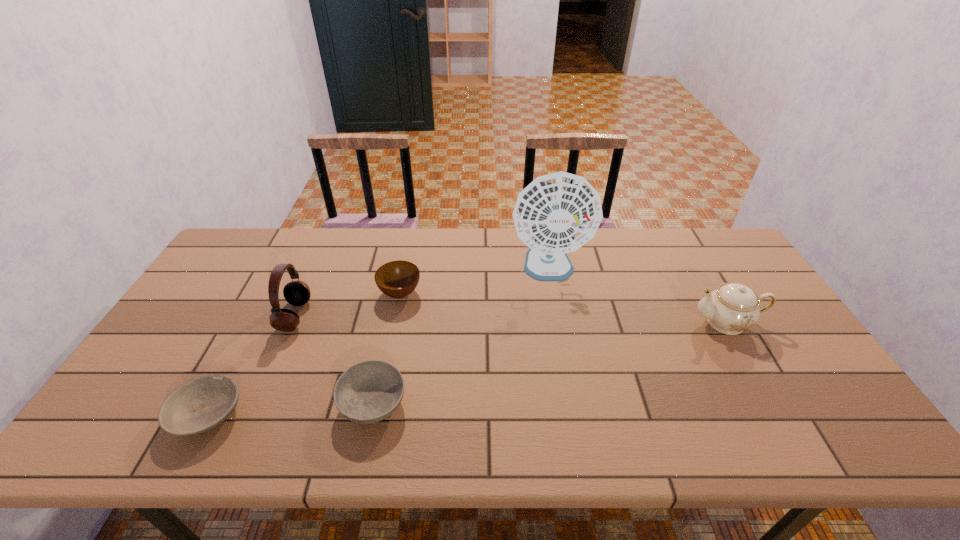
You are a GUI agent. You are given a task and a screenshot of the screen. Output one action in this format:
    pyautogui.click(x=<x>, y=<y>)
    Task: Click on the free spot located at the spout of the chinaware
    The width and height of the screenshot is (960, 540).
    Given the screenshot: What is the action you would take?
    pyautogui.click(x=670, y=322)

This screenshot has height=540, width=960. Find the location of `free spot located 0.150m at the spout of the chinaware`. free spot located 0.150m at the spout of the chinaware is located at coordinates (638, 322).

What are the coordinates of `blank area located at the spout of the chinaware` in the screenshot? It's located at (593, 322).

The image size is (960, 540). What are the coordinates of `free location located 0.050m on the left of the farthest bowl` in the screenshot? It's located at (362, 293).

I want to click on free space located 0.240m on the right of the shortest bowl, so click(x=344, y=415).

You are a GUI agent. You are given a task and a screenshot of the screen. Output one action in this format:
    pyautogui.click(x=<x>, y=<y>)
    Task: Click on the object that is at the far edge
    
    Given the screenshot: What is the action you would take?
    pyautogui.click(x=557, y=213)

This screenshot has width=960, height=540. In order to click on object located at the left edge in this screenshot , I will do `click(200, 404)`.

What are the coordinates of `object that is at the right edge` in the screenshot? It's located at (732, 308).

Find the location of a particular element. The height and width of the screenshot is (540, 960). object present at the near left corner is located at coordinates (200, 404).

Image resolution: width=960 pixels, height=540 pixels. In the image, there is a desktop. Find the location of `free region at the far edge`. free region at the far edge is located at coordinates (383, 265).